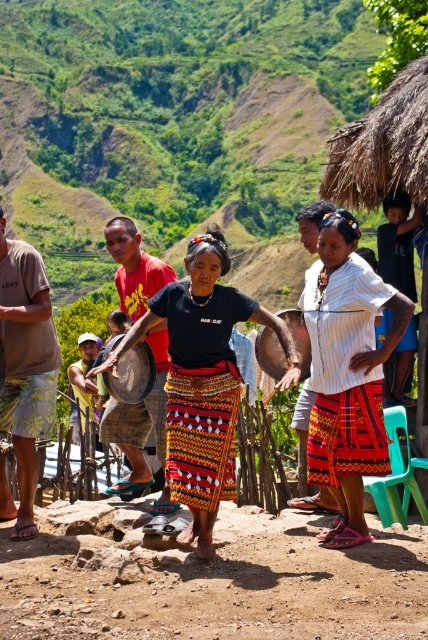
Does dusty brown ground at center appear on the left side of brown cotton shirt at left?

Incorrect, dusty brown ground at center is not on the left side of brown cotton shirt at left.

Is point (315, 630) behind point (26, 483)?

No.

Identify the location of dusty brown ground at center. (211, 582).

Is brown cotton shirt at left thinner than shiny metallic gong at center?

In fact, brown cotton shirt at left might be wider than shiny metallic gong at center.

Who is shorter, brown cotton shirt at left or shiny metallic gong at center?

Standing shorter between the two is shiny metallic gong at center.

Locate an element on the screen. The height and width of the screenshot is (640, 428). brown cotton shirt at left is located at coordinates (24, 372).

Find the location of a particular element. brown cotton shirt at left is located at coordinates (24, 372).

Consider the image. Does white woven shirt at center have a greater height compared to shiny metallic gong at center?

Indeed, white woven shirt at center has a greater height compared to shiny metallic gong at center.

Can you confirm if white woven shirt at center is positioned to the left of shiny metallic gong at center?

Incorrect, white woven shirt at center is not on the left side of shiny metallic gong at center.

Between point (362, 294) and point (300, 362), which one is positioned in front?

Positioned in front is point (362, 294).

Locate an element on the screen. Image resolution: width=428 pixels, height=640 pixels. white woven shirt at center is located at coordinates (347, 374).